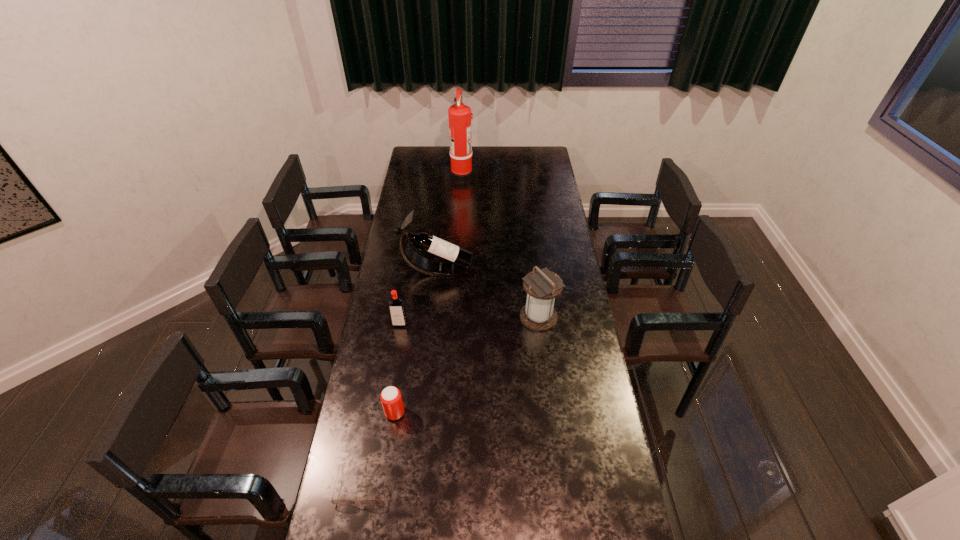
At what (x,y) coordinates should I click in order to perform the action: click on vacant region that satisfies the following two spatial constraints: 1. at the nozzle of the farthest object; 2. on the right side of the fourth shortest object. Please return your answer as a coordinate pair (x, y). Looking at the image, I should click on (454, 317).

Identify the location of free space that satisfies the following two spatial constraints: 1. at the nozzle of the farthest object; 2. on the left side of the rightmost object. The height and width of the screenshot is (540, 960). (454, 317).

You are a GUI agent. You are given a task and a screenshot of the screen. Output one action in this format:
    pyautogui.click(x=<x>, y=<y>)
    Task: Click on the free space that satisfies the following two spatial constraints: 1. on the stand of the wine bottle; 2. on the front and back of the vodka
    Image resolution: width=960 pixels, height=540 pixels.
    Given the screenshot: What is the action you would take?
    pyautogui.click(x=431, y=323)

I want to click on free space that satisfies the following two spatial constraints: 1. on the stand of the wine bottle; 2. on the back side of the third tallest object, so click(432, 317).

At what (x,y) coordinates should I click in order to perform the action: click on free space in the image that satisfies the following two spatial constraints: 1. at the nozzle of the farthest object; 2. on the front side of the second shortest object. Please return your answer as a coordinate pair (x, y). This screenshot has height=540, width=960. Looking at the image, I should click on (449, 413).

Identify the location of free region that satisfies the following two spatial constraints: 1. at the nozzle of the farthest object; 2. on the front side of the fifth tallest object. (x=449, y=413).

Locate an element on the screen. The width and height of the screenshot is (960, 540). free region that satisfies the following two spatial constraints: 1. on the stand of the second farthest object; 2. on the back side of the lantern is located at coordinates (x=432, y=317).

This screenshot has height=540, width=960. I want to click on free location that satisfies the following two spatial constraints: 1. at the nozzle of the fire extinguisher; 2. on the face of the shortest object, so click(x=445, y=485).

Identify the location of vacant space that satisfies the following two spatial constraints: 1. on the front and back of the beer can; 2. on the left side of the third shortest object. The width and height of the screenshot is (960, 540). (385, 413).